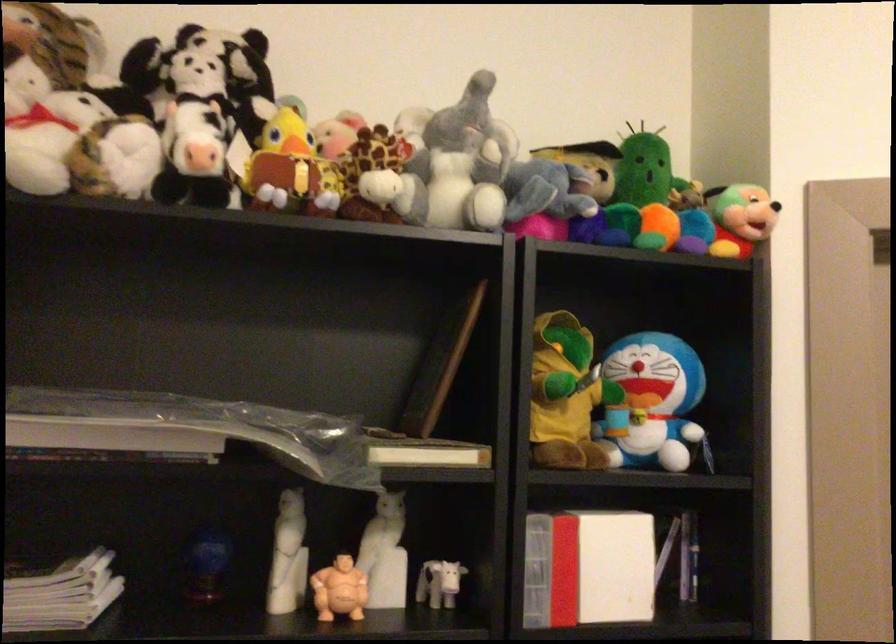
What do you see at coordinates (438, 583) in the screenshot?
I see `the small cow figurine` at bounding box center [438, 583].